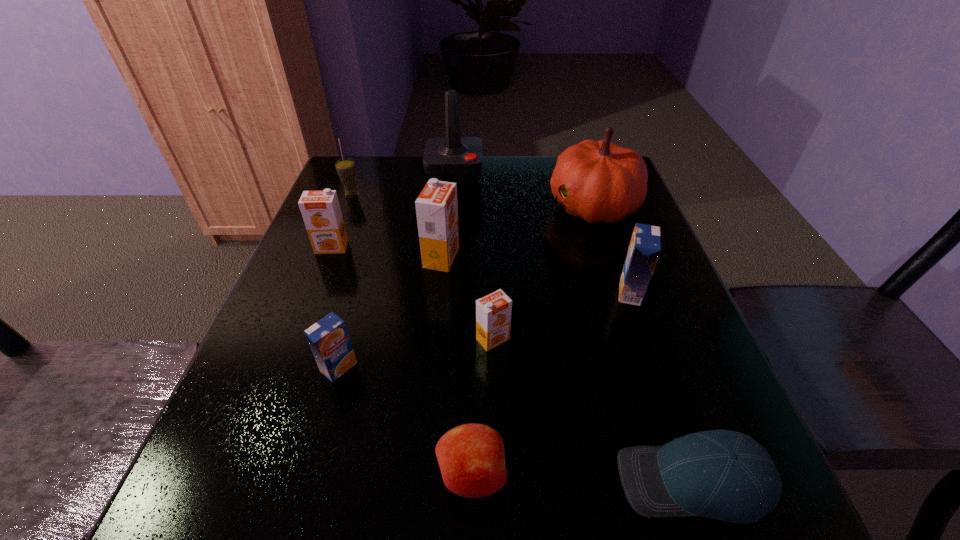
At what (x,y) coordinates should I click in order to perform the action: click on vacant space located 0.400m on the front-facing side of the pink pumpkin. Please return your answer as a coordinate pair (x, y). Looking at the image, I should click on (391, 205).

What are the coordinates of `vacant point located on the right of the tallest orange juice` in the screenshot? It's located at (567, 258).

This screenshot has width=960, height=540. I want to click on free space located on the back of the yellow straw for drinking, so click(x=364, y=164).

Locate an element on the screen. blank space located 0.290m on the front of the sixth farthest object is located at coordinates 685,448.

Locate an element on the screen. This screenshot has height=540, width=960. vacant region located on the back of the leftmost orange orange juice is located at coordinates (350, 200).

I want to click on blank space located 0.240m on the back of the third object from left to right, so click(x=368, y=264).

The image size is (960, 540). Find the location of `free space located on the front of the fourth nearest object`. free space located on the front of the fourth nearest object is located at coordinates (497, 505).

Identify the location of vacant space located on the left of the apple. (255, 475).

The height and width of the screenshot is (540, 960). Find the location of `free spot located 0.120m on the back of the shortest object`. free spot located 0.120m on the back of the shortest object is located at coordinates (657, 374).

Locate an element on the screen. This screenshot has height=540, width=960. joystick located in the far edge section of the desktop is located at coordinates (456, 159).